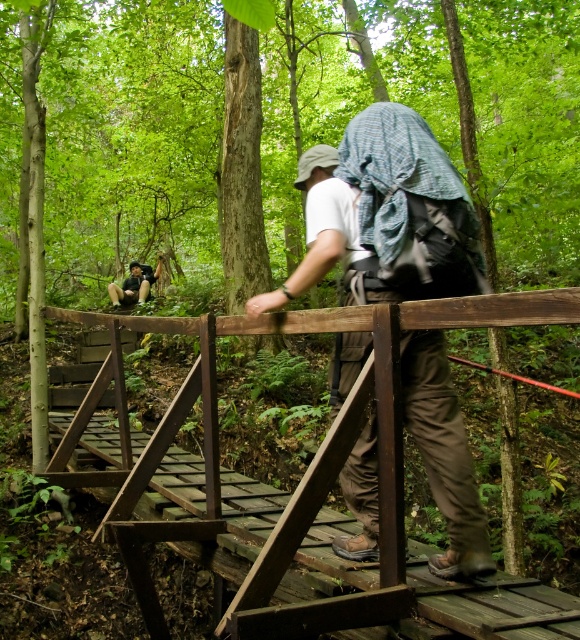
Question: Which of the following is the closest to the observer?

Choices:
 (A) rustic wooden bridge at center
 (B) matte black backpack at center
 (C) matte black backpack at lower left

Answer: (A)

Question: Estimate the real-world distances between objects in this image. Which object is closer to the matte black backpack at lower left?

Choices:
 (A) matte black backpack at center
 (B) rustic wooden bridge at center

Answer: (B)

Question: Does rustic wooden bridge at center have a lesser width compared to matte black backpack at lower left?

Choices:
 (A) yes
 (B) no

Answer: (B)

Question: Which of these objects is positioned farthest from the matte black backpack at lower left?

Choices:
 (A) rustic wooden bridge at center
 (B) matte black backpack at center

Answer: (B)

Question: Does matte black backpack at center appear on the left side of matte black backpack at lower left?

Choices:
 (A) no
 (B) yes

Answer: (A)

Question: Can you confirm if matte black backpack at center is wider than matte black backpack at lower left?

Choices:
 (A) no
 (B) yes

Answer: (B)